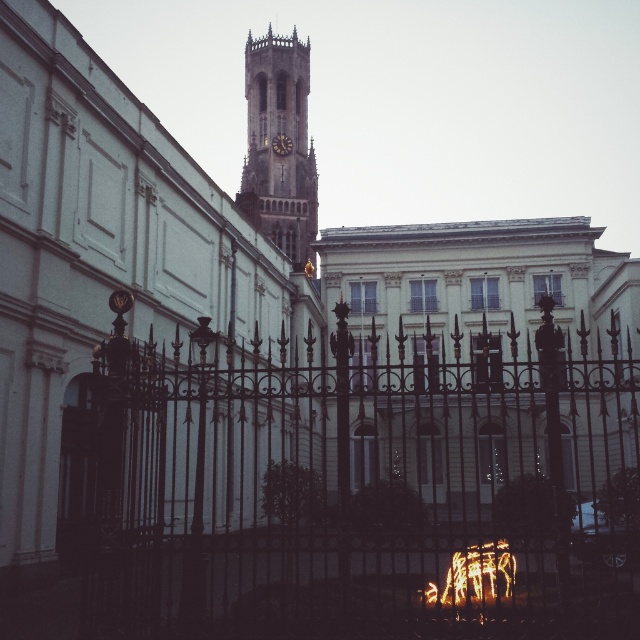
Question: From the image, what is the correct spatial relationship of black wrought iron gate at center in relation to brown stone clock tower at center?

Choices:
 (A) left
 (B) right

Answer: (B)

Question: Which point is farther to the camera?

Choices:
 (A) dark brown wooden clock at center
 (B) brown stone clock tower at center
 (C) black wrought iron gate at center

Answer: (A)

Question: Which of the following is the farthest from the observer?

Choices:
 (A) black wrought iron gate at center
 (B) dark brown wooden clock at center

Answer: (B)

Question: Among these points, which one is farthest from the camera?

Choices:
 (A) (376, 531)
 (B) (284, 145)

Answer: (B)

Question: In this image, where is brown stone clock tower at center located relative to dark brown wooden clock at center?

Choices:
 (A) left
 (B) right

Answer: (B)

Question: Can you confirm if black wrought iron gate at center is positioned to the right of dark brown wooden clock at center?

Choices:
 (A) yes
 (B) no

Answer: (A)